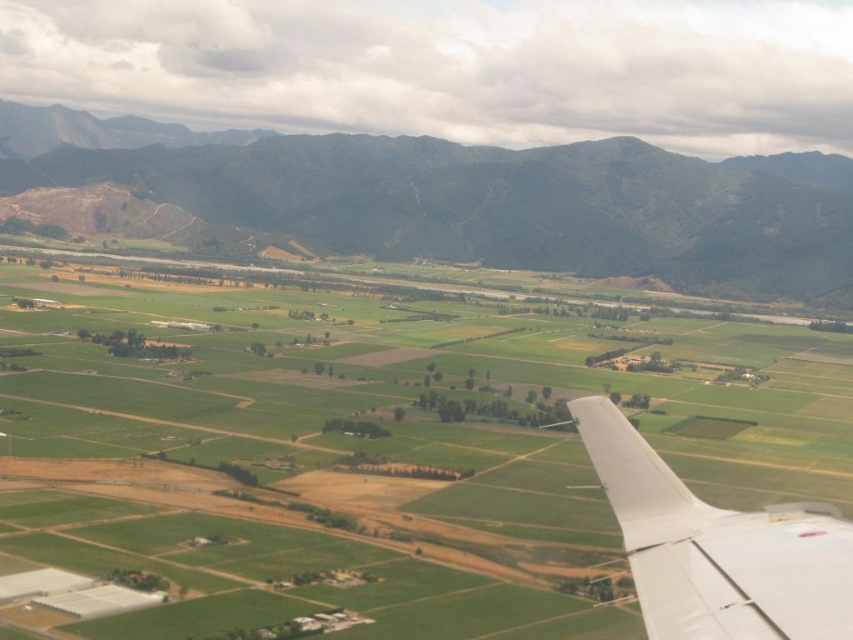
You are a pilot observing the landscape below from the airplane window. You notice the green grassland at center and the green grassy mountain at upper center. Which of these two features appears narrower when viewed from above?

The green grassland at center appears narrower than the green grassy mountain at upper center because it is thinner.

You are a passenger on an airplane and notice the green grassy mountain at upper center and the white matte wing at lower right through the window. Which object appears higher in your field of view?

The green grassy mountain at upper center appears higher in the field of view because it is positioned above the white matte wing at lower right.